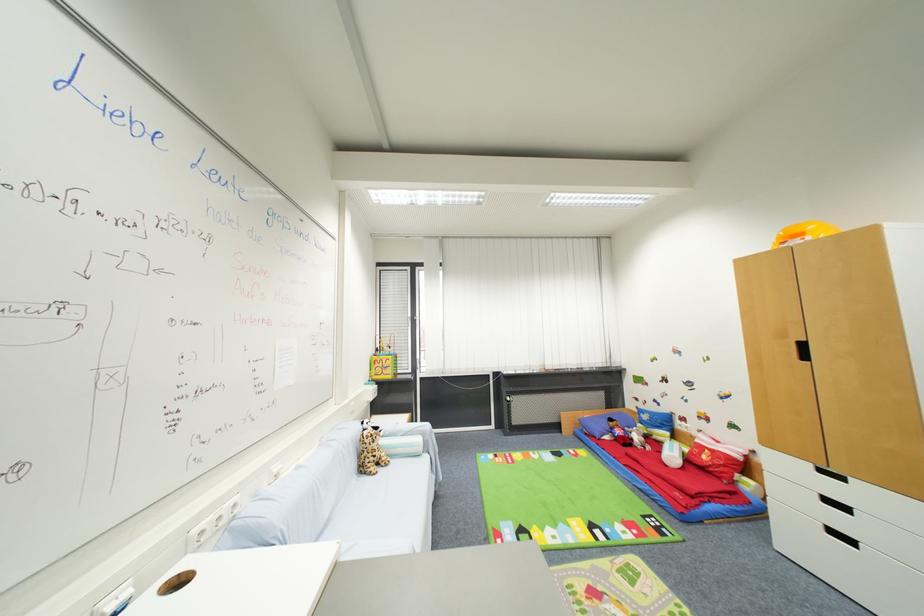
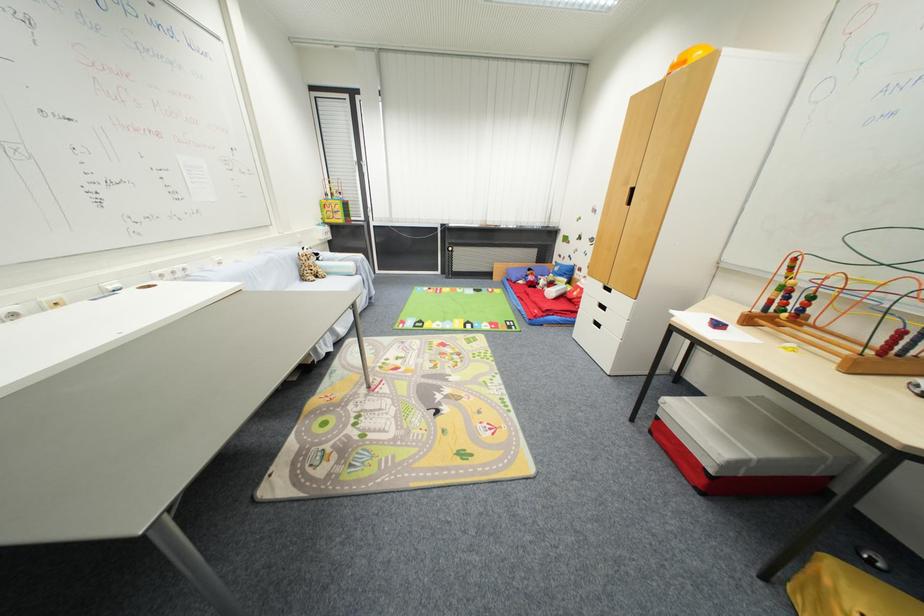
Find the pixel in the second image that matches the point at 857,544 in the first image.

(604, 328)